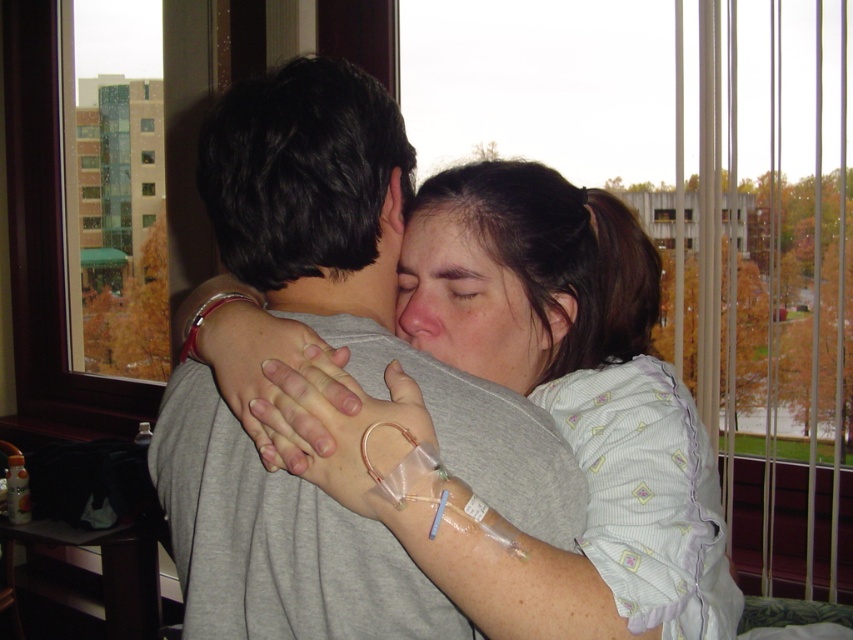
Question: Does gray matte shirt at center have a greater width compared to matte skin forehead at center?

Choices:
 (A) yes
 (B) no

Answer: (A)

Question: Which of these objects is positioned closest to the smooth skin face at center?

Choices:
 (A) matte skin forehead at center
 (B) gray matte shirt at center

Answer: (A)

Question: Does gray matte shirt at center appear under matte skin forehead at center?

Choices:
 (A) no
 (B) yes

Answer: (B)

Question: Which object is farther from the camera taking this photo?

Choices:
 (A) smooth skin face at center
 (B) matte skin forehead at center
 (C) gray matte shirt at center

Answer: (B)

Question: Which object is closer to the camera taking this photo?

Choices:
 (A) smooth skin face at center
 (B) matte skin forehead at center

Answer: (A)

Question: Is gray matte shirt at center positioned behind smooth skin face at center?

Choices:
 (A) yes
 (B) no

Answer: (B)